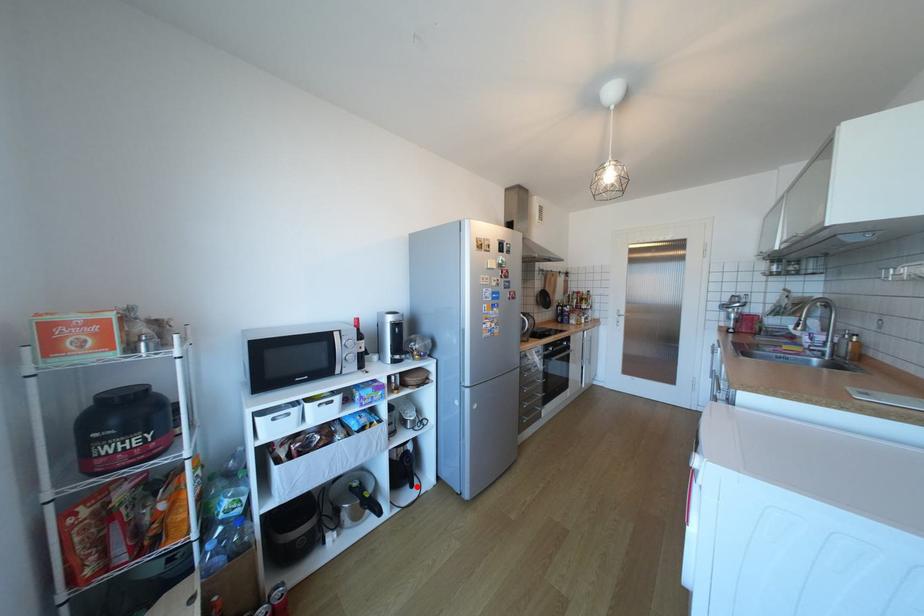
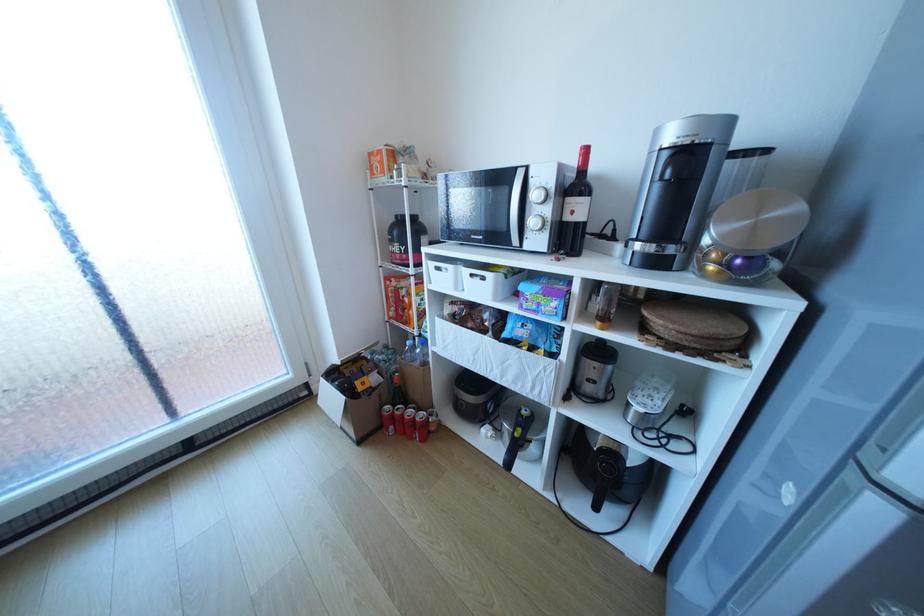
Question: I am providing you with two images of the same scene from different viewpoints. In image1, a red point is highlighted. Considering the same 3D point in image2, which of the following is correct?

Choices:
 (A) It is closer
 (B) It is farther

Answer: (A)